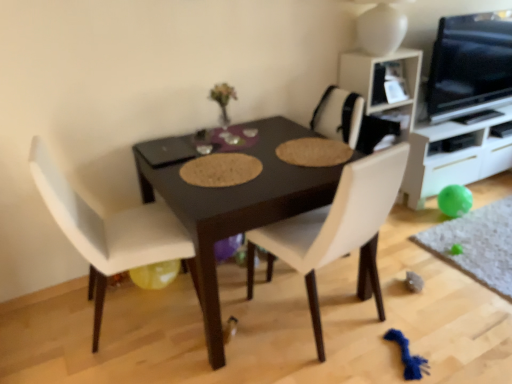
This screenshot has height=384, width=512. I want to click on free location in front of white leather chair at left, the 1th chair in the left-to-right sequence, so tap(134, 362).